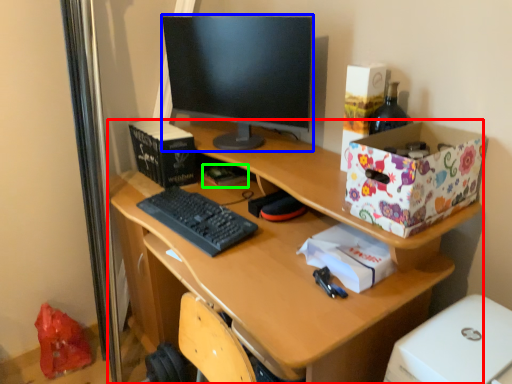
Question: Estimate the real-world distances between objects in this image. Which object is farther from desk (highlighted by a red box), television (highlighted by a blue box) or book (highlighted by a green box)?

Choices:
 (A) television
 (B) book

Answer: (B)